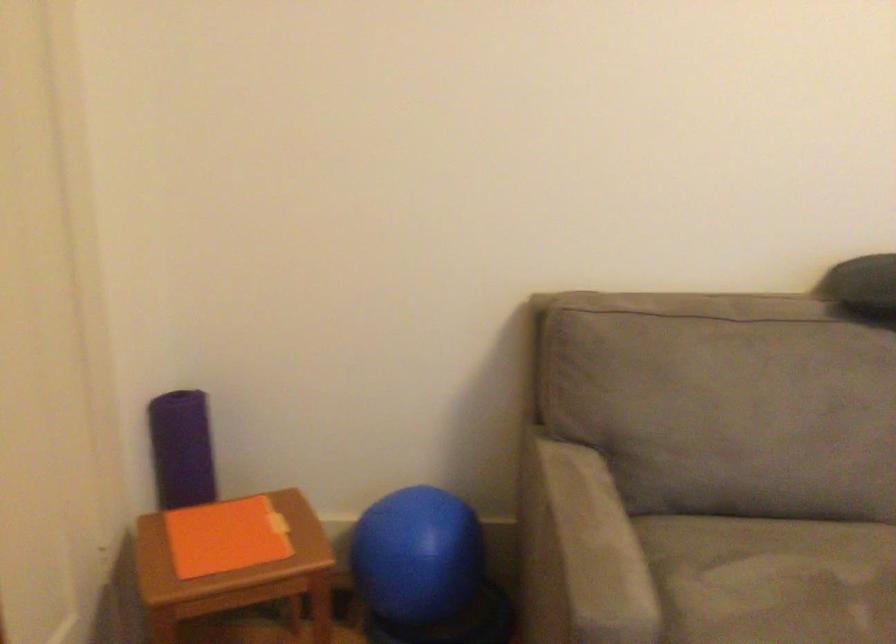
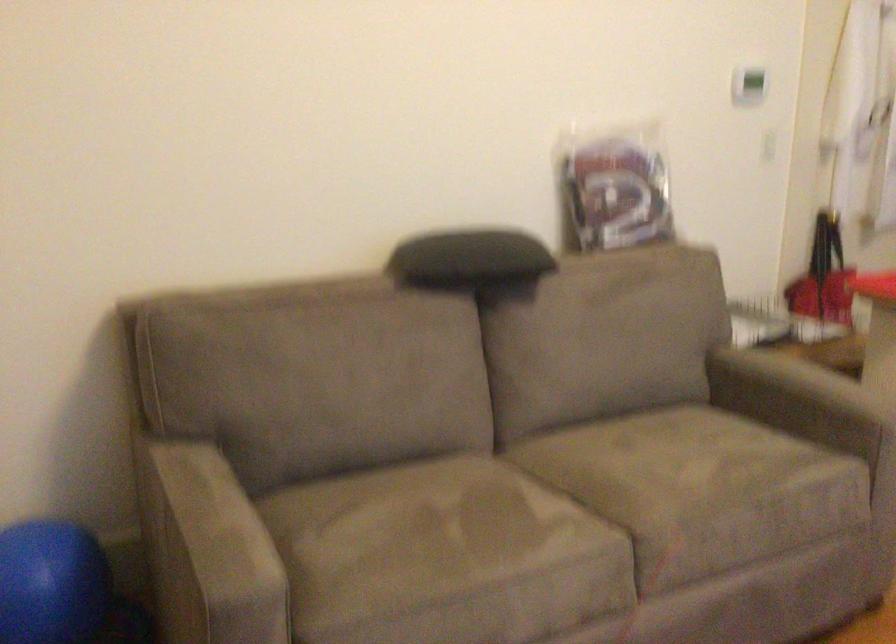
Find the pixel in the second image that matches [435,550] in the first image.

(49, 583)